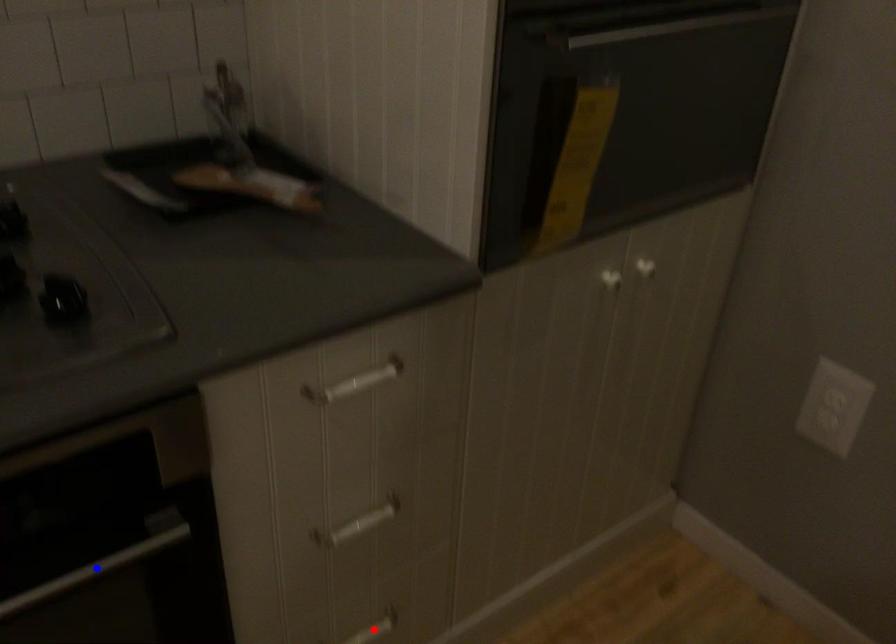
Question: Two points are marked on the image. Which point is closer to the camera?

Choices:
 (A) Blue point is closer.
 (B) Red point is closer.

Answer: (A)